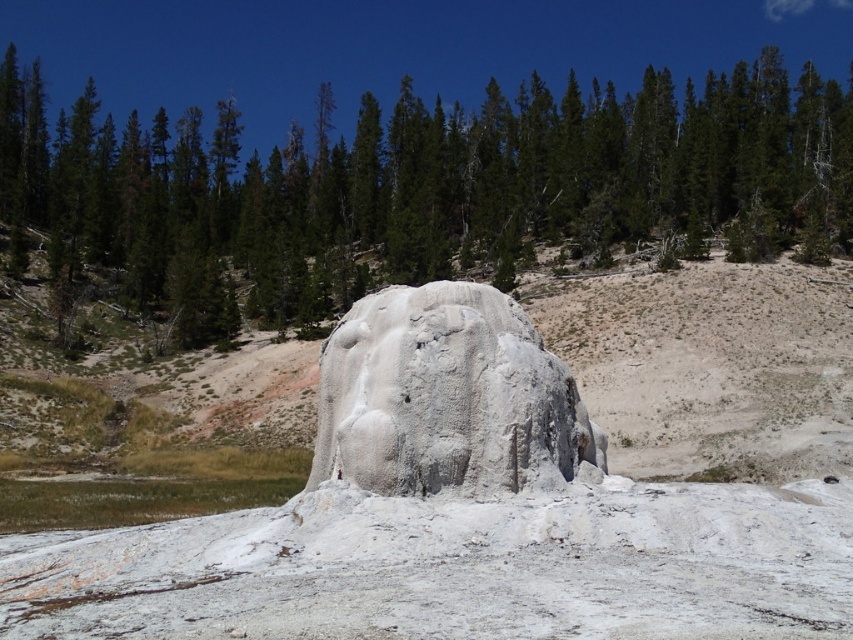
Is point (802, 102) more distant than point (422, 360)?

Yes, point (802, 102) is behind point (422, 360).

Can you confirm if green leafy trees at center is positioned above white textured rock at center?

Yes, green leafy trees at center is above white textured rock at center.

At what (x,y) coordinates should I click in order to perform the action: click on green leafy trees at center. Please return your answer as a coordinate pair (x, y). The width and height of the screenshot is (853, 640). Looking at the image, I should click on (422, 189).

Where is `green leafy trees at center`? The image size is (853, 640). green leafy trees at center is located at coordinates (422, 189).